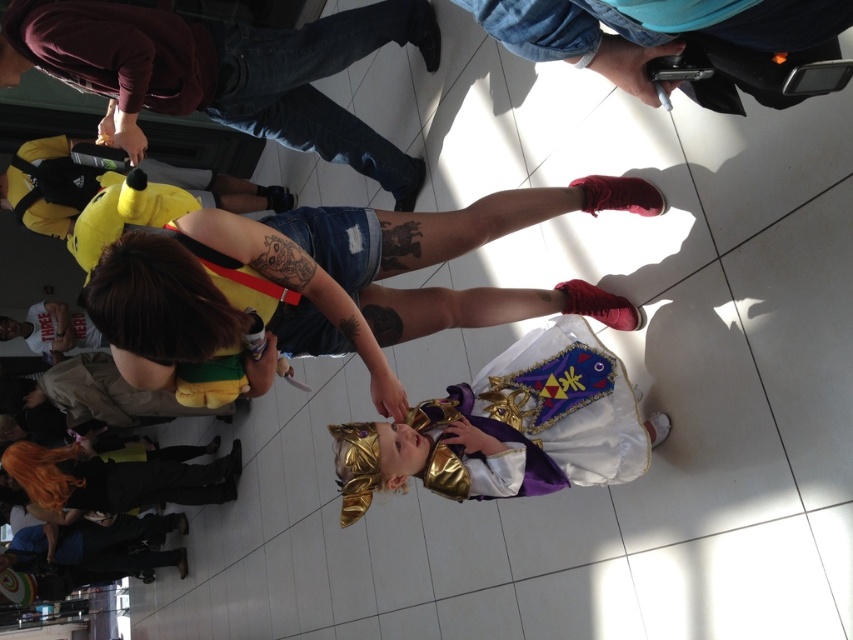
This screenshot has width=853, height=640. What do you see at coordinates (305, 285) in the screenshot?
I see `denim shorts at center` at bounding box center [305, 285].

Can you confirm if denim shorts at center is positioned below blue denim jeans at upper center?

Yes, denim shorts at center is below blue denim jeans at upper center.

I want to click on denim shorts at center, so click(305, 285).

What are the coordinates of `denim shorts at center` in the screenshot? It's located at (305, 285).

Can you confirm if blue denim jeans at upper center is positioned to the right of yellow plush toy at left?

Indeed, blue denim jeans at upper center is positioned on the right side of yellow plush toy at left.

Is blue denim jeans at upper center above yellow plush toy at left?

No, blue denim jeans at upper center is not above yellow plush toy at left.

Is point (779, 51) closer to camera compared to point (283, 208)?

Yes, it is.

I want to click on blue denim jeans at upper center, so point(671,38).

Is yellow plush toy at lower left positioned before white fabric sock at lower center?

That is False.

Where is `yellow plush toy at lower left`? yellow plush toy at lower left is located at coordinates (223, 72).